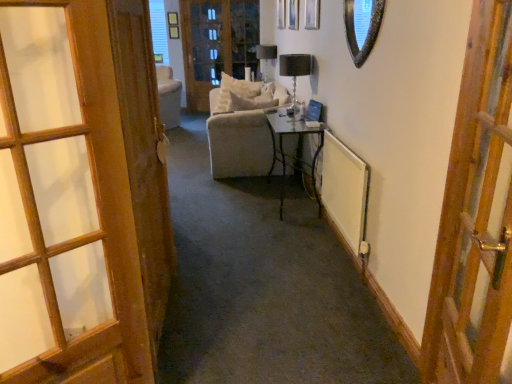
Question: Is matte black table lamp at upper center, which is the second table lamp in right-to-left order, taller or shorter than white soft pillow at center?

Choices:
 (A) short
 (B) tall

Answer: (B)

Question: Does point (273, 64) appear closer or farther from the camera than point (227, 105)?

Choices:
 (A) farther
 (B) closer

Answer: (A)

Question: Which of these objects is positioned farthest from the white soft pillow at center?

Choices:
 (A) wooden door at right, the 1th door viewed from the right
 (B) matte black table lamp at upper center, which ranks as the first table lamp in left-to-right order
 (C) black glass table lamp at center, which appears as the second table lamp when viewed from the top
 (D) clear glass table at center
 (E) wooden door at left, acting as the first door starting from the left

Answer: (A)

Question: Which object is the closest to the black glass table lamp at center, which appears as the 1th table lamp when viewed from the front?

Choices:
 (A) clear glass screen door at upper center
 (B) wooden door at right, the 3th door when ordered from left to right
 (C) wooden door at left, arranged as the third door when viewed from the right
 (D) matte black table lamp at upper center, which ranks as the first table lamp in left-to-right order
 (E) shiny silver mirror at upper right

Answer: (E)